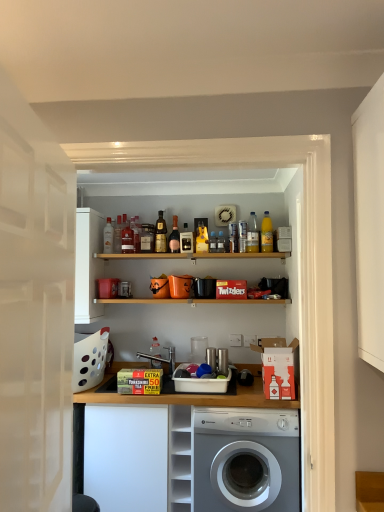
Question: Is matte glass bottle at upper center, the ninth bottle from the right, completely or partially inside matte black mug at center?

Choices:
 (A) no
 (B) yes

Answer: (A)

Question: Is matte black mug at center located outside matte glass bottle at upper center, the ninth bottle from the right?

Choices:
 (A) no
 (B) yes

Answer: (B)

Question: Does matte black mug at center have a greater height compared to matte glass bottle at upper center, the ninth bottle from the right?

Choices:
 (A) no
 (B) yes

Answer: (A)

Question: Does matte black mug at center lie behind matte glass bottle at upper center, which ranks as the 3th bottle in left-to-right order?

Choices:
 (A) no
 (B) yes

Answer: (A)

Question: Is matte black mug at center positioned with its back to matte glass bottle at upper center, which ranks as the 3th bottle in left-to-right order?

Choices:
 (A) yes
 (B) no

Answer: (B)

Question: From the image's perspective, does matte black mug at center appear higher than matte glass bottle at upper center, which ranks as the 3th bottle in left-to-right order?

Choices:
 (A) no
 (B) yes

Answer: (A)

Question: From a real-world perspective, is yellow glass bottle at upper center, which ranks as the 11th bottle in left-to-right order, over matte black mug at center?

Choices:
 (A) yes
 (B) no

Answer: (A)

Question: Is yellow glass bottle at upper center, which ranks as the 11th bottle in left-to-right order, not close to matte black mug at center?

Choices:
 (A) yes
 (B) no

Answer: (B)

Question: Can you confirm if yellow glass bottle at upper center, the 1th bottle in the right-to-left sequence, is wider than matte black mug at center?

Choices:
 (A) yes
 (B) no

Answer: (B)

Question: Is yellow glass bottle at upper center, the 1th bottle in the right-to-left sequence, further to the viewer compared to matte black mug at center?

Choices:
 (A) no
 (B) yes

Answer: (A)

Question: Is yellow glass bottle at upper center, which ranks as the 11th bottle in left-to-right order, taller than matte black mug at center?

Choices:
 (A) no
 (B) yes

Answer: (B)

Question: Does yellow glass bottle at upper center, which ranks as the 11th bottle in left-to-right order, appear on the right side of matte black mug at center?

Choices:
 (A) no
 (B) yes

Answer: (B)

Question: Is white plastic cabinet at lower center facing towards translucent plastic bottle at upper center, the second bottle when ordered from right to left?

Choices:
 (A) yes
 (B) no

Answer: (B)